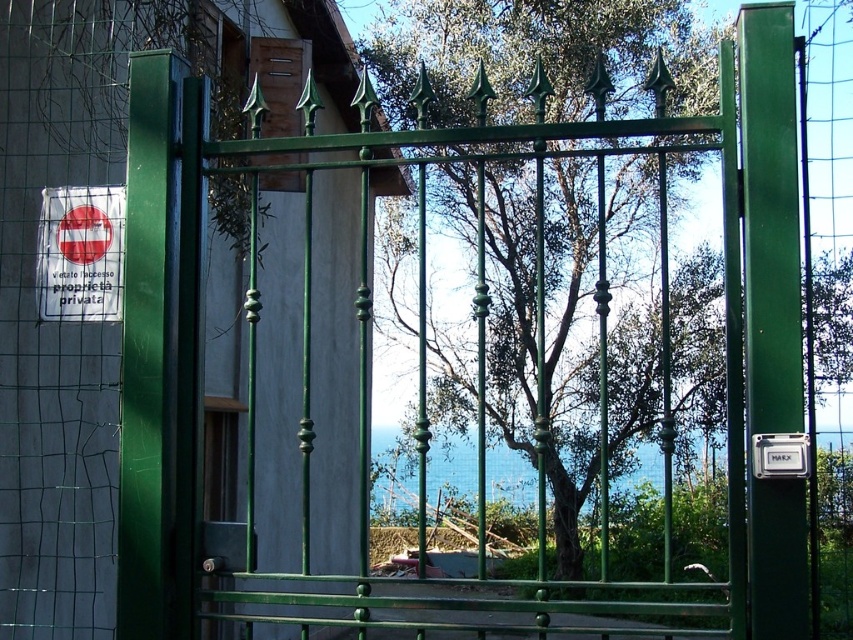
Does white plastic sign at left appear on the right side of white plastic parking sign at right?

In fact, white plastic sign at left is to the left of white plastic parking sign at right.

Who is more distant from viewer, (113, 275) or (762, 465)?

Point (113, 275)

Does point (74, 259) come behind point (801, 465)?

Yes.

Find the location of `white plastic sign at left`. white plastic sign at left is located at coordinates (80, 253).

Between green metal tree at center and white plastic sign at left, which one has more height?

Standing taller between the two is green metal tree at center.

Between green metal tree at center and white plastic sign at left, which one appears on the left side from the viewer's perspective?

white plastic sign at left

Which is behind, point (500, 182) or point (48, 224)?

Point (500, 182)

Find the location of `green metal tree at center`. green metal tree at center is located at coordinates (538, 54).

Is the position of green metal tree at center less distant than that of white plastic parking sign at right?

That is False.

Is green metal tree at center above white plastic parking sign at right?

Incorrect, green metal tree at center is not positioned above white plastic parking sign at right.

This screenshot has height=640, width=853. What are the coordinates of `green metal tree at center` in the screenshot? It's located at (538, 54).